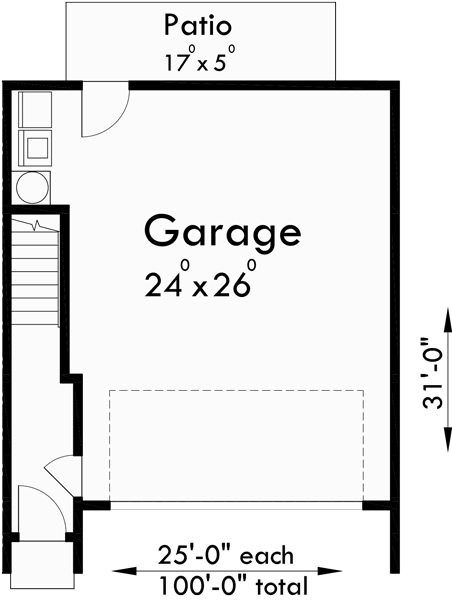
Where is `laundry room`? The image size is (452, 600). laundry room is located at coordinates (37, 128).